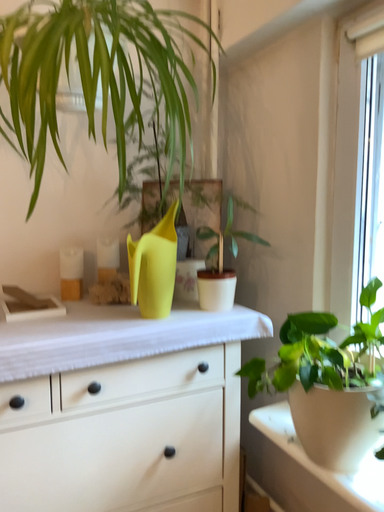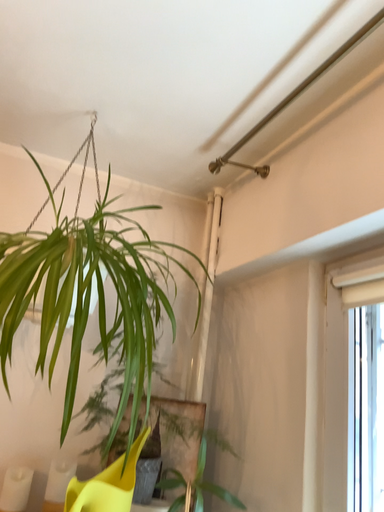
Question: Which way did the camera rotate in the video?

Choices:
 (A) rotated upward
 (B) rotated downward

Answer: (A)